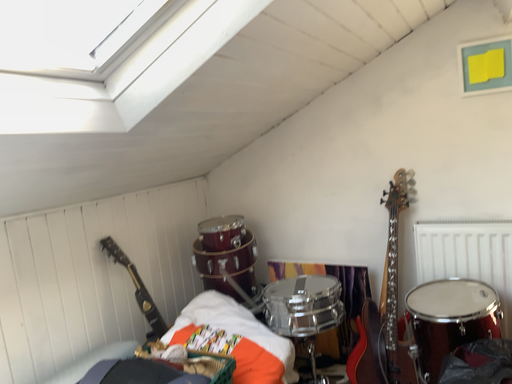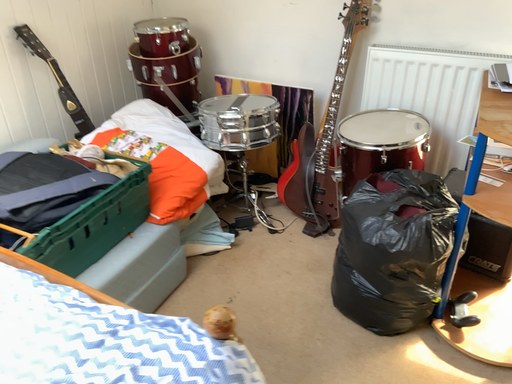
Question: How did the camera likely rotate when shooting the video?

Choices:
 (A) rotated upward
 (B) rotated downward

Answer: (B)